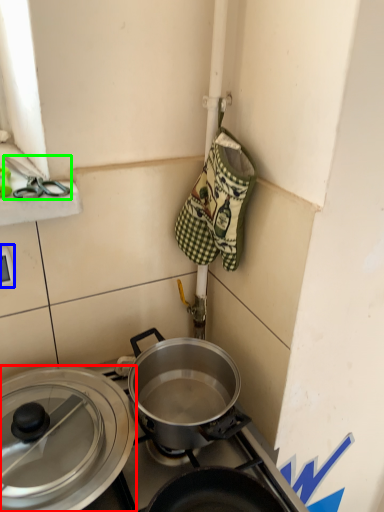
Question: Which is farther away from pot/pan (highlighted by a red box)? electric outlet (highlighted by a blue box) or scissors (highlighted by a green box)?

Choices:
 (A) electric outlet
 (B) scissors

Answer: (B)